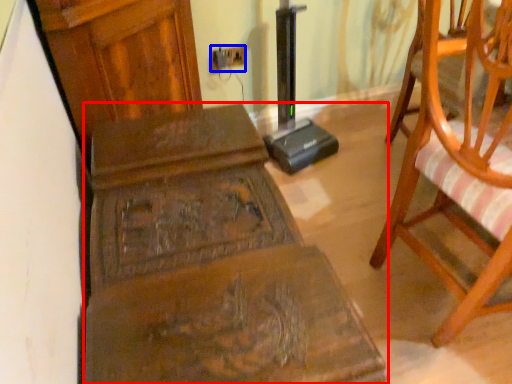
Question: Which object is closer to the camera taking this photo, furniture (highlighted by a red box) or electric outlet (highlighted by a blue box)?

Choices:
 (A) furniture
 (B) electric outlet

Answer: (A)